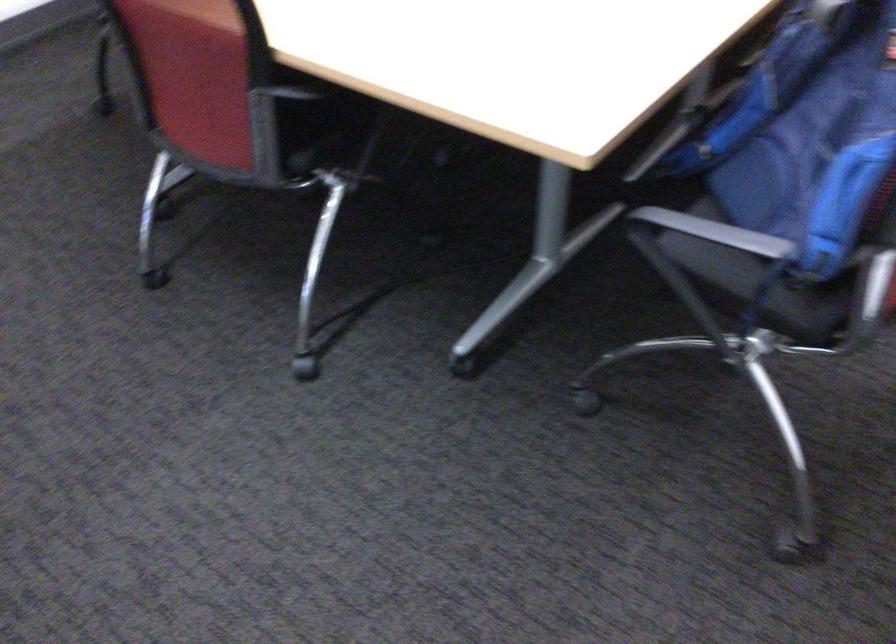
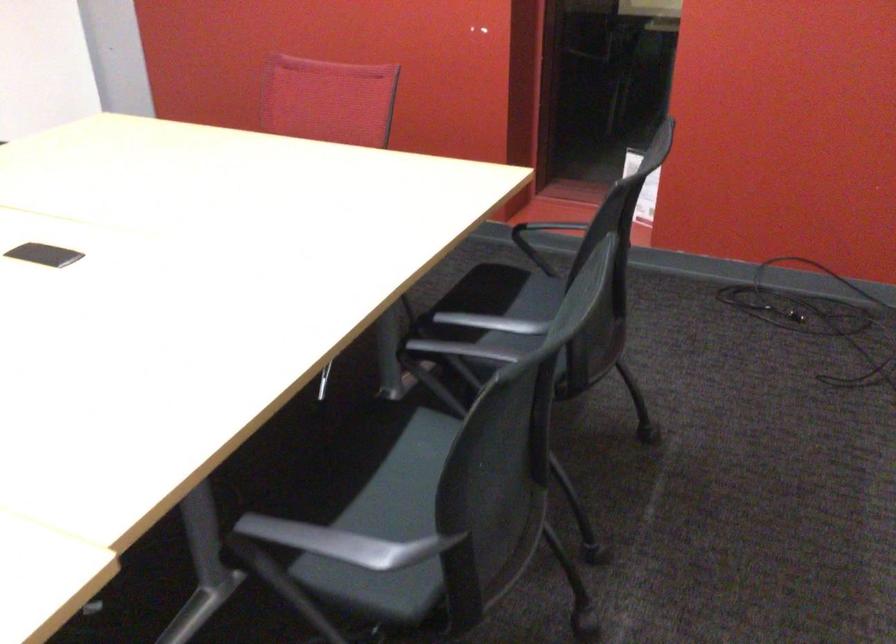
Which direction would the cameraman need to move to produce the second image?

The movement direction of the cameraman is right, forward.